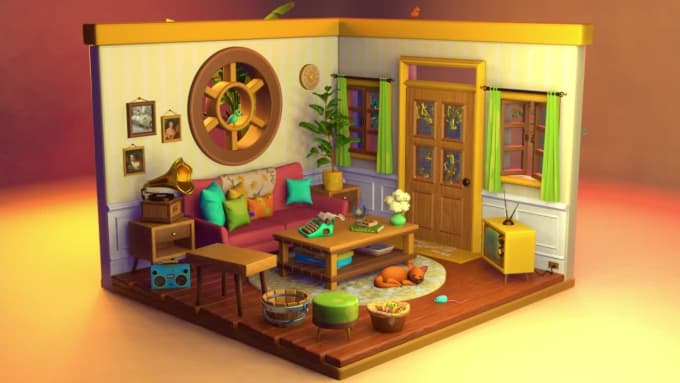
Identify the location of couch. Image resolution: width=680 pixels, height=383 pixels. (258, 211).